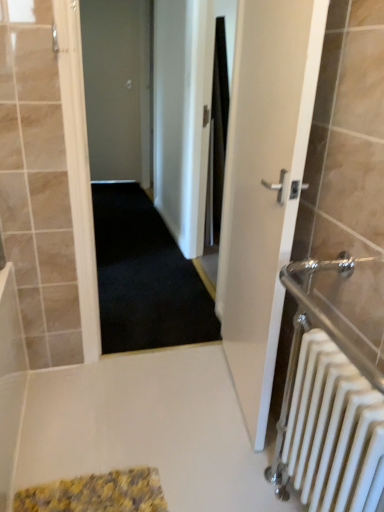
Question: From a real-world perspective, is white metallic radiator at right positioned under white glossy door at center right, which appears as the 2th door when viewed from the left, based on gravity?

Choices:
 (A) no
 (B) yes

Answer: (B)

Question: Is white metallic radiator at right in contact with white glossy door at center right, which is the 1th door in bottom-to-top order?

Choices:
 (A) yes
 (B) no

Answer: (B)

Question: Is white metallic radiator at right positioned with its back to white glossy door at center right, placed as the 1th door when sorted from right to left?

Choices:
 (A) no
 (B) yes

Answer: (A)

Question: Does white metallic radiator at right have a smaller size compared to white glossy door at center right, arranged as the 2th door when viewed from the back?

Choices:
 (A) yes
 (B) no

Answer: (A)

Question: From the image's perspective, is white metallic radiator at right beneath white glossy door at center right, placed as the 1th door when sorted from right to left?

Choices:
 (A) yes
 (B) no

Answer: (A)

Question: Is the depth of white metallic radiator at right greater than that of white glossy door at center right, the 2th door viewed from the top?

Choices:
 (A) yes
 (B) no

Answer: (B)

Question: Does white glossy door at center right, placed as the 1th door when sorted from right to left, come in front of dark carpet at center?

Choices:
 (A) no
 (B) yes

Answer: (B)

Question: Is white glossy door at center right, which appears as the 2th door when viewed from the left, touching dark carpet at center?

Choices:
 (A) yes
 (B) no

Answer: (B)

Question: Is dark carpet at center at the back of white glossy door at center right, arranged as the 2th door when viewed from the back?

Choices:
 (A) no
 (B) yes

Answer: (A)

Question: Can you confirm if white glossy door at center right, which is the 1th door from front to back, is positioned to the right of dark carpet at center?

Choices:
 (A) no
 (B) yes

Answer: (B)

Question: Does white glossy door at center right, which appears as the 2th door when viewed from the left, have a greater height compared to dark carpet at center?

Choices:
 (A) yes
 (B) no

Answer: (B)

Question: Does white glossy door at center right, which appears as the 2th door when viewed from the left, contain dark carpet at center?

Choices:
 (A) yes
 (B) no

Answer: (B)

Question: Would you say matte gray door at center, the 1th door in the back-to-front sequence, is a long distance from white glossy door at center right, which appears as the 2th door when viewed from the left?

Choices:
 (A) no
 (B) yes

Answer: (B)